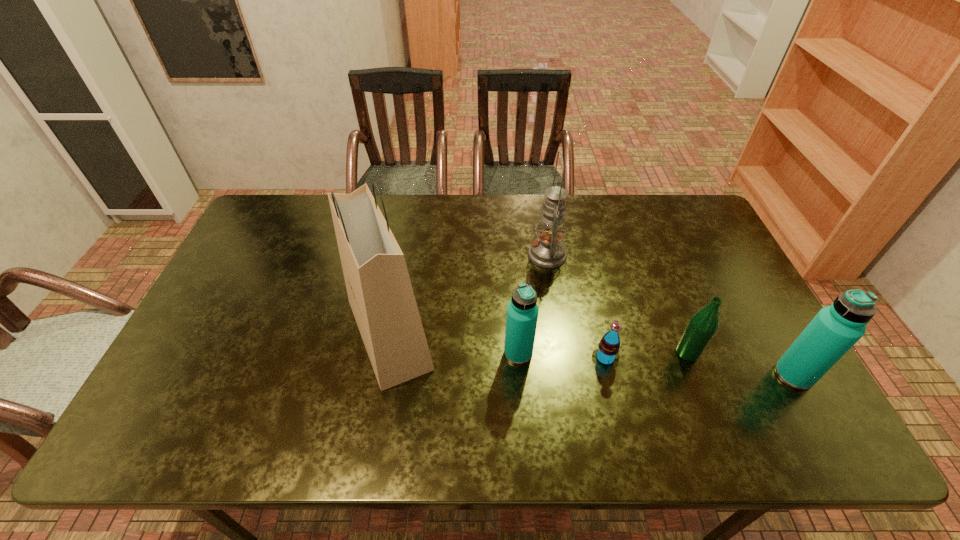
Where is `the leftmost object`? the leftmost object is located at coordinates (380, 293).

Locate an element on the screen. This screenshot has height=540, width=960. shopping bag is located at coordinates (380, 293).

Find the location of `vacant space located on the right of the second object from left to right`. vacant space located on the right of the second object from left to right is located at coordinates (666, 353).

This screenshot has width=960, height=540. Identify the location of vacant space positioned on the left of the fourth shortest object. (712, 375).

You are a GUI agent. You are given a task and a screenshot of the screen. Output one action in this format:
    pyautogui.click(x=<x>, y=<y>)
    Task: Click on the free region located on the back of the farthest object
    The height and width of the screenshot is (540, 960).
    Given the screenshot: What is the action you would take?
    (540, 204)

Where is `free point located on the back of the fifth tallest object`? This screenshot has width=960, height=540. free point located on the back of the fifth tallest object is located at coordinates (649, 253).

Where is `vacant space located on the left of the shortest object`? This screenshot has height=540, width=960. vacant space located on the left of the shortest object is located at coordinates (445, 358).

What are the coordinates of `vacant region located 0.400m on the left of the tallest object` in the screenshot? It's located at (193, 334).

The height and width of the screenshot is (540, 960). I want to click on water bottle that is at the near edge, so click(x=835, y=329).

The width and height of the screenshot is (960, 540). Identify the location of shopping bag located at the near edge. click(x=380, y=293).